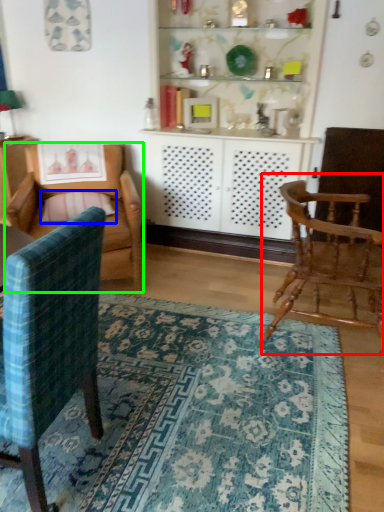
Question: Which is farther away from chair (highlighted by a red box)? pillow (highlighted by a blue box) or chair (highlighted by a green box)?

Choices:
 (A) pillow
 (B) chair

Answer: (A)